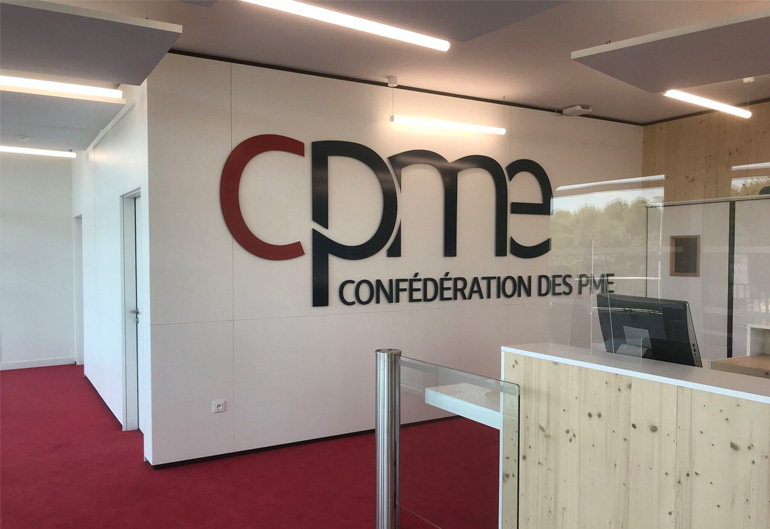
At what (x,y) coordinates should I click in order to perform the action: click on 1 desk. Please return your answer as a coordinate pair (x, y). Image resolution: width=770 pixels, height=529 pixels. Looking at the image, I should click on (732, 383).